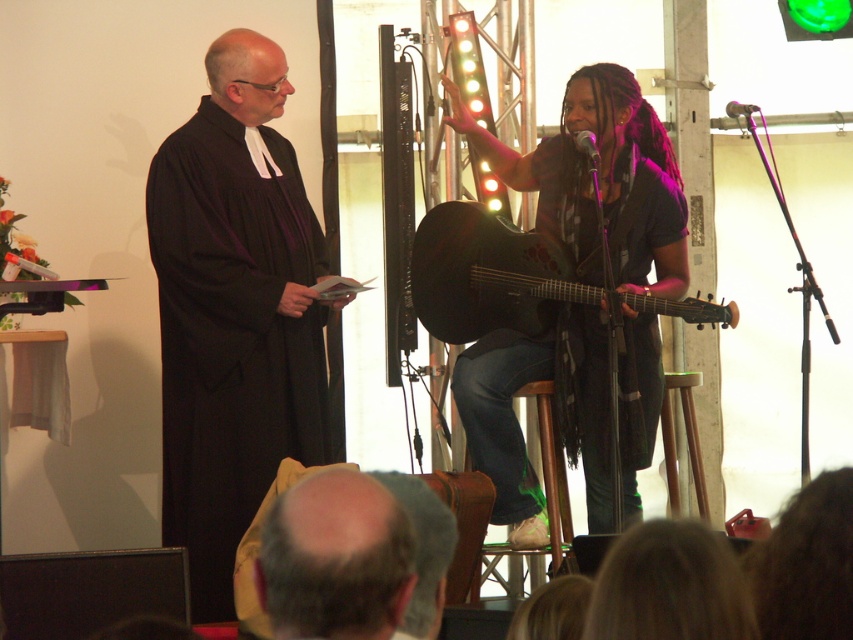
Question: Does black matte robe at left appear under metallic silver microphone at center?

Choices:
 (A) no
 (B) yes

Answer: (B)

Question: Considering the real-world distances, which object is farthest from the matte black acoustic guitar at center?

Choices:
 (A) metallic silver microphone at upper center
 (B) matte black guitar at center
 (C) bald head at lower center
 (D) black matte robe at left

Answer: (C)

Question: Which of the following is the farthest from the observer?

Choices:
 (A) matte black acoustic guitar at center
 (B) black matte robe at left
 (C) metallic silver microphone at center

Answer: (B)

Question: Can you confirm if bald head at lower center is smaller than metallic silver microphone at upper center?

Choices:
 (A) no
 (B) yes

Answer: (A)

Question: Is black matte robe at left wider than matte black guitar at center?

Choices:
 (A) no
 (B) yes

Answer: (A)

Question: Considering the real-world distances, which object is closest to the metallic silver microphone at upper center?

Choices:
 (A) matte black acoustic guitar at center
 (B) matte black guitar at center

Answer: (B)